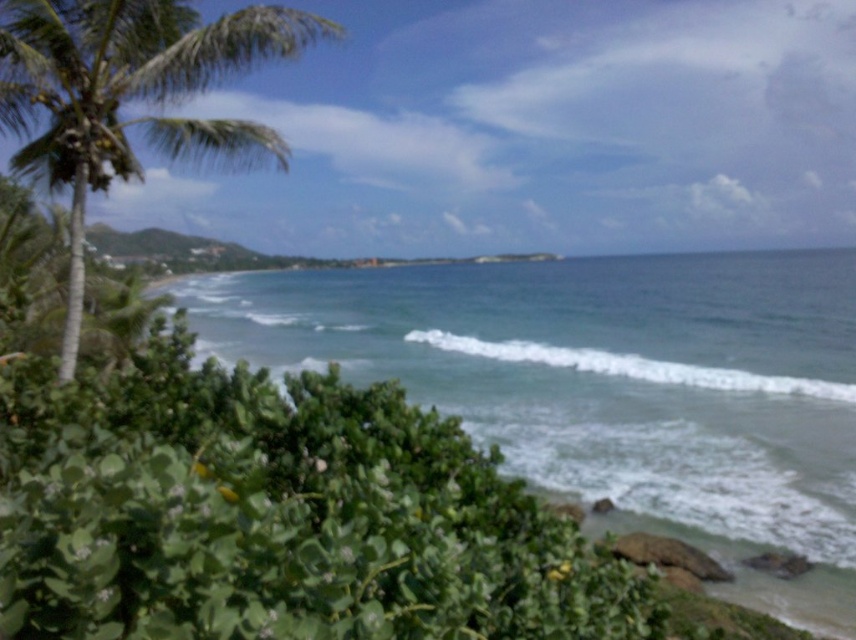
Is point (765, 406) positioned behind point (752, 380)?

No, it is in front of (752, 380).

Who is more distant from viewer, (655, 364) or (619, 358)?

The point (619, 358) is more distant.

Is point (765, 584) positioned behind point (406, 333)?

No, it is not.

Find the location of a particular element. green leafy water at lower left is located at coordinates (609, 387).

The width and height of the screenshot is (856, 640). What do you see at coordinates (129, 96) in the screenshot? I see `green leafy palm tree at left` at bounding box center [129, 96].

Does point (186, 76) come farther from viewer compared to point (729, 381)?

That is False.

Does point (51, 58) come closer to viewer compared to point (513, 340)?

Yes, it is.

At what (x,y) coordinates should I click in order to perform the action: click on green leafy palm tree at left. Please return your answer as a coordinate pair (x, y). This screenshot has width=856, height=640. Looking at the image, I should click on (129, 96).

Looking at this image, between green leafy water at lower left and green leafy palm tree at left, which one is positioned lower?

Positioned lower is green leafy palm tree at left.

Between point (849, 433) and point (75, 134), which one is positioned in front?

Point (75, 134) is in front.

Is point (530, 429) more distant than point (58, 17)?

Yes, it is.

Identify the location of green leafy water at lower left. (609, 387).